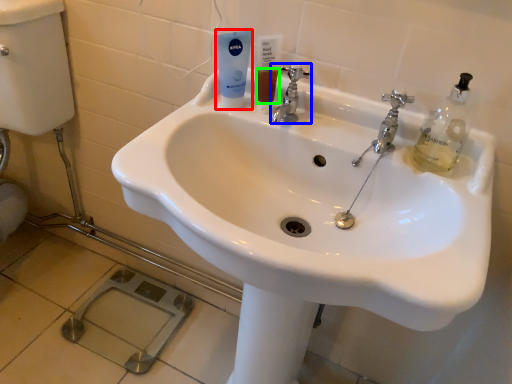
Question: Which is nearer to the mouthwash (highlighted by a red box)? tap (highlighted by a blue box) or liquid (highlighted by a green box).

Choices:
 (A) tap
 (B) liquid

Answer: (B)